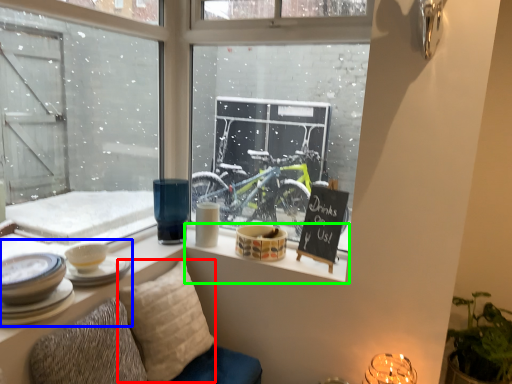
Question: Which object is positioned closest to pillow (highlighted by a red box)? Select from tableware (highlighted by a blue box) and window sill (highlighted by a green box).

Choices:
 (A) tableware
 (B) window sill

Answer: (B)